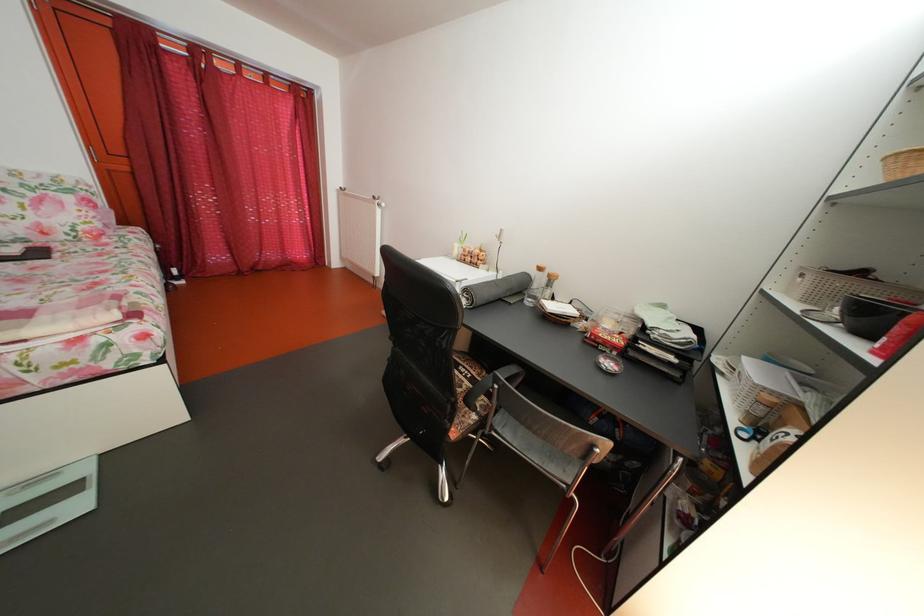
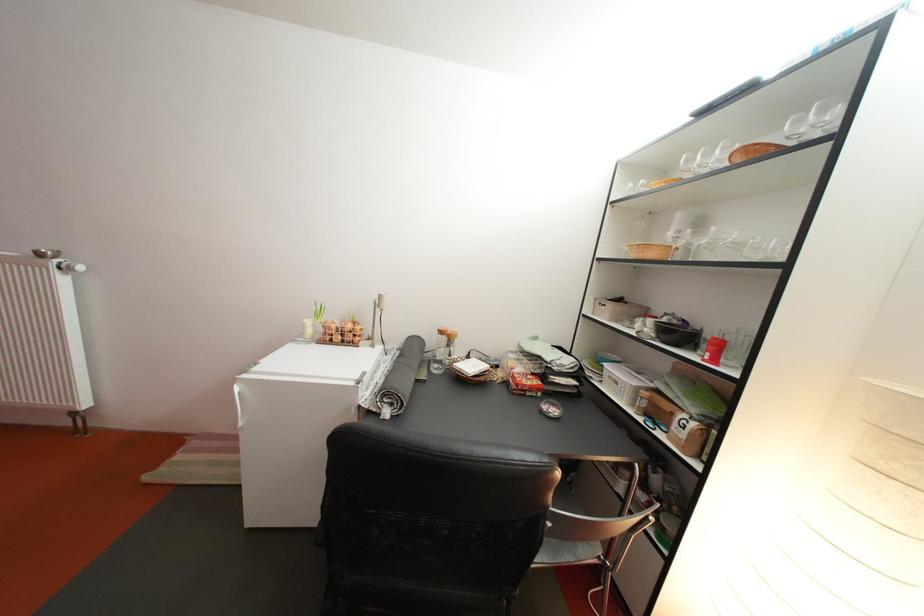
In the second image, find the point that corresponds to pixel 551 286 in the first image.

(444, 346)